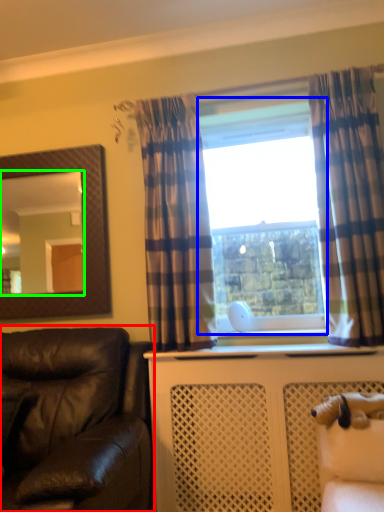
Question: Considering the real-world distances, which object is farthest from studio couch (highlighted by a red box)? window frame (highlighted by a blue box) or mirror (highlighted by a green box)?

Choices:
 (A) window frame
 (B) mirror

Answer: (B)